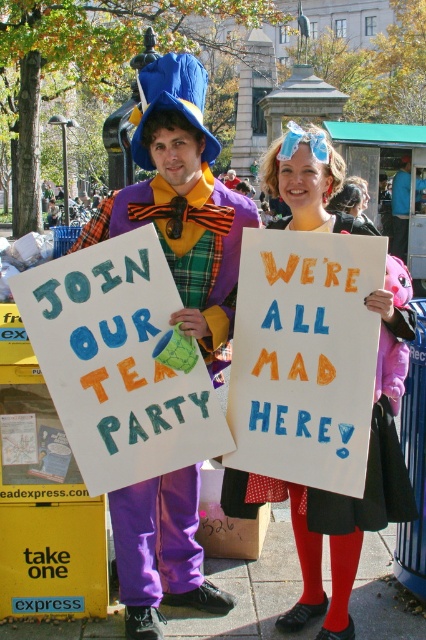
From the picture: Is matte purple pants at center closer to the viewer compared to handwritten paper sign at center?

No, matte purple pants at center is behind handwritten paper sign at center.

Measure the distance between point (350, 228) and camera.

Point (350, 228) and camera are 4.88 meters apart.

Identify the location of matte purple pants at center. This screenshot has width=426, height=640. 181,202.

The width and height of the screenshot is (426, 640). Find the location of `matte purple pants at center`. matte purple pants at center is located at coordinates (181, 202).

Is matte purple pants at center taller than purple plaid vest at center?

Correct, matte purple pants at center is much taller as purple plaid vest at center.

Does point (169, 120) come farther from viewer compared to point (233, 300)?

No.

Find the location of a particular element. The image size is (426, 640). matte purple pants at center is located at coordinates (181, 202).

Is point (276, 166) positioned in front of point (360, 515)?

No, it is not.

This screenshot has width=426, height=640. What do you see at coordinates (181, 202) in the screenshot?
I see `matte purple pants at center` at bounding box center [181, 202].

This screenshot has width=426, height=640. Identify the location of matte purple pants at center. (181, 202).